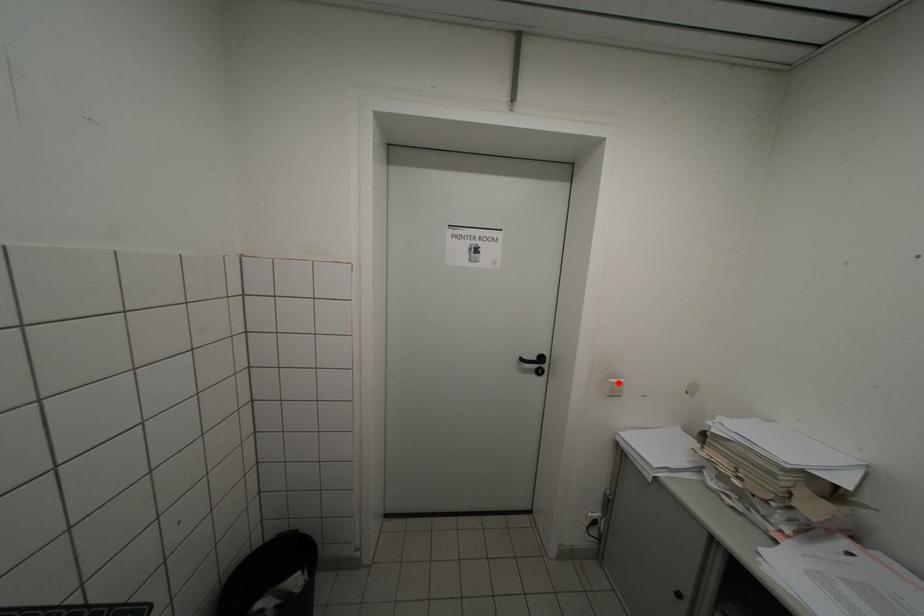
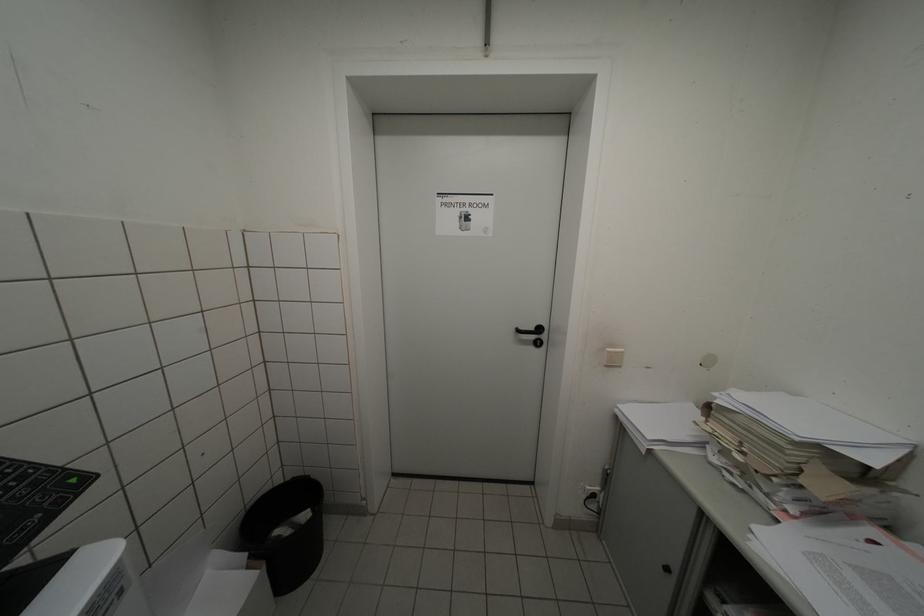
Locate, in the second image, the point that corresponds to the highlighted location in the first image.

(615, 352)